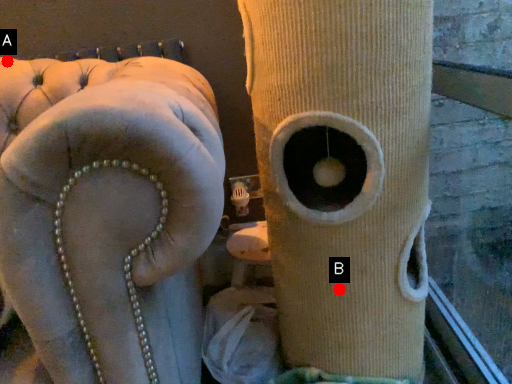
Question: Two points are circled on the image, labeled by A and B beside each circle. Which point is closer to the camera?

Choices:
 (A) A is closer
 (B) B is closer

Answer: (B)